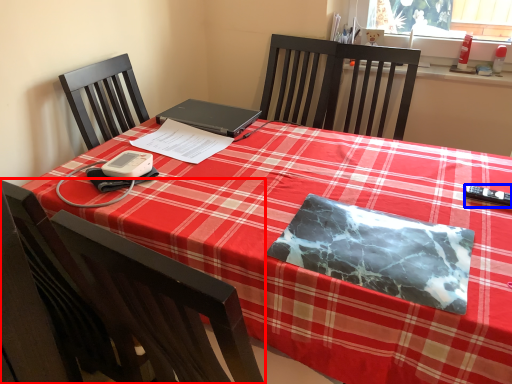
Question: Which object is closer to the camera taking this photo, chair (highlighted by a red box) or remote control (highlighted by a blue box)?

Choices:
 (A) chair
 (B) remote control

Answer: (A)